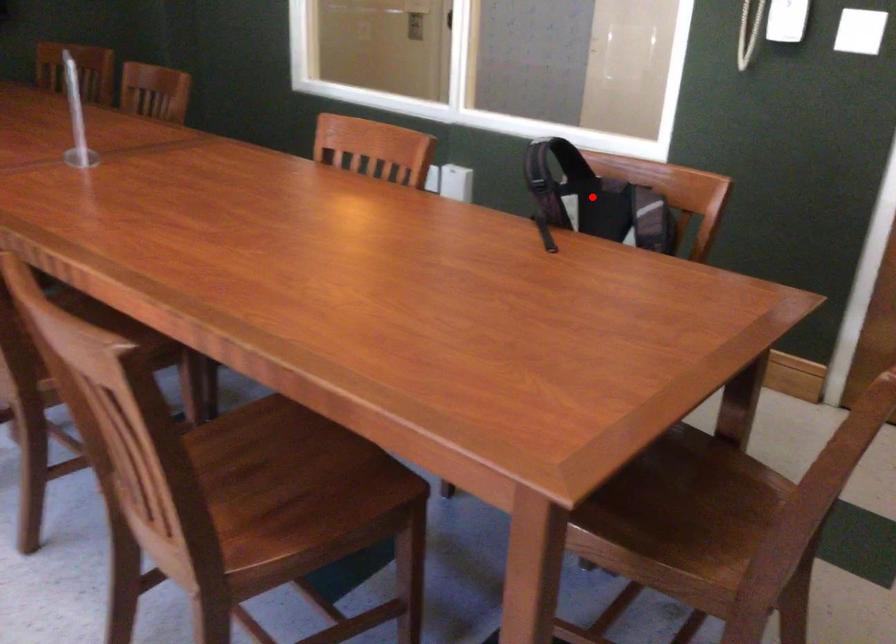
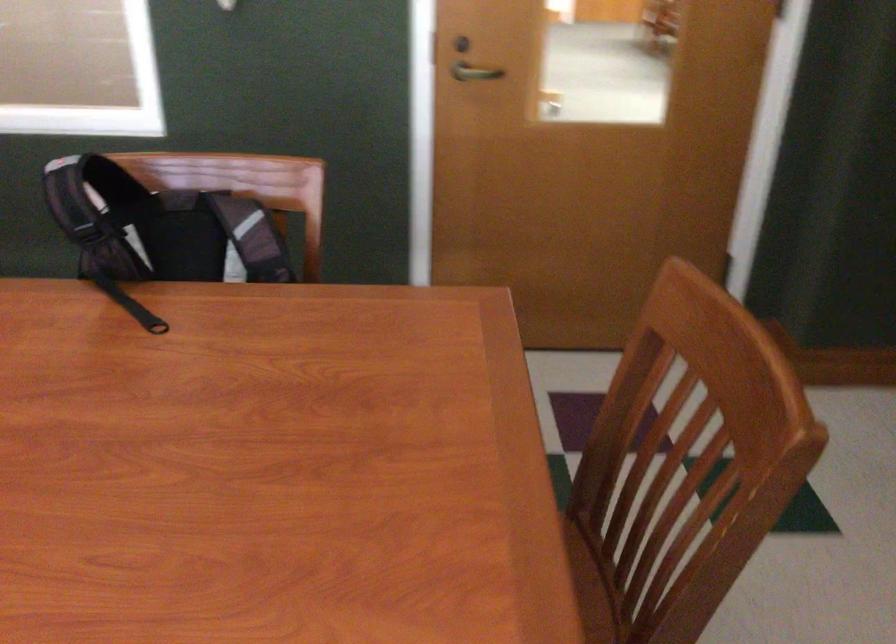
Find the pixel in the second image that matches the highlighted location in the first image.

(159, 228)